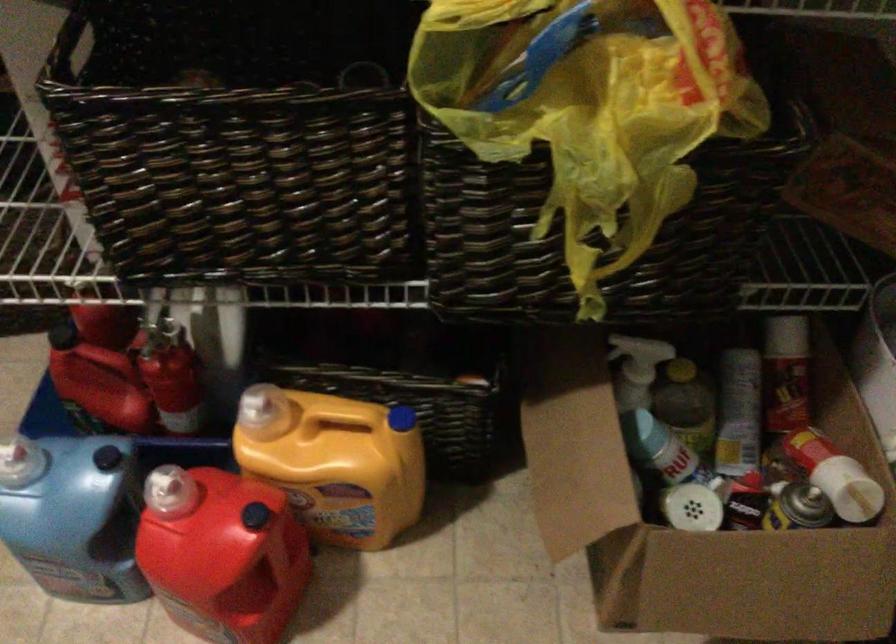
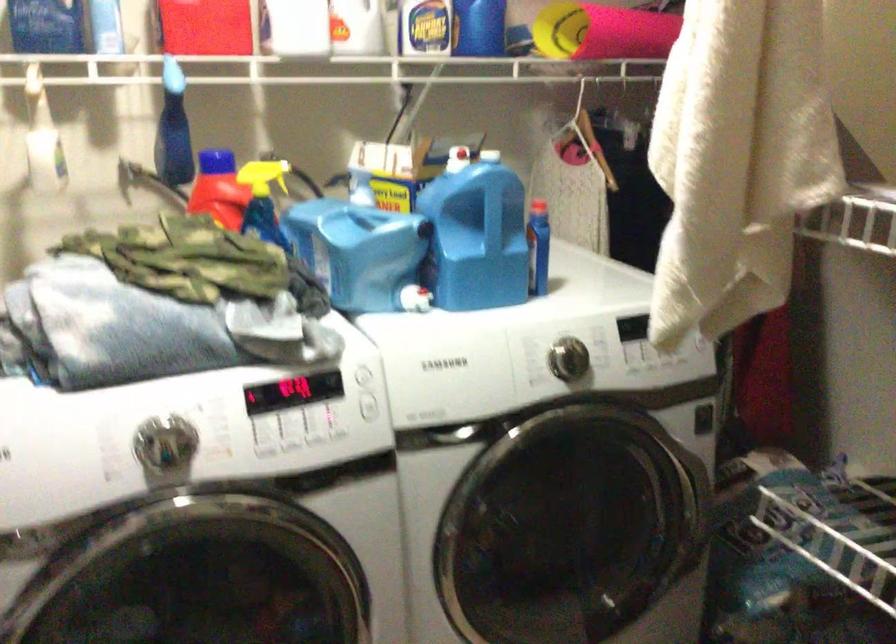
Question: The first image is from the beginning of the video and the second image is from the end. How did the camera likely rotate when shooting the video?

Choices:
 (A) Left
 (B) Right
 (C) Up
 (D) Down

Answer: (A)